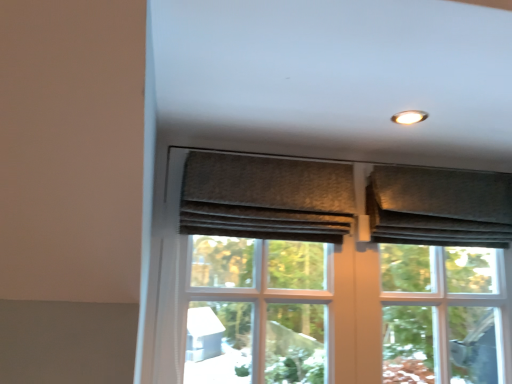
Question: Is matte brown screen door at center wider or thinner than textured gray fabric at upper right?

Choices:
 (A) thin
 (B) wide

Answer: (A)

Question: From the image's perspective, is matte brown screen door at center positioned above or below textured gray fabric at upper right?

Choices:
 (A) above
 (B) below

Answer: (B)

Question: Estimate the real-world distances between objects in this image. Which object is closer to the textured gray curtain at upper center, which is the 1th curtain in left-to-right order?

Choices:
 (A) matte brown screen door at center
 (B) textured gray fabric at upper right
 (C) textured gray curtain at upper right, the 2th curtain viewed from the left

Answer: (A)

Question: Estimate the real-world distances between objects in this image. Which object is farther from the matte brown screen door at center?

Choices:
 (A) textured gray curtain at upper center, which ranks as the second curtain in right-to-left order
 (B) textured gray fabric at upper right
 (C) textured gray curtain at upper right, the 1th curtain when ordered from right to left

Answer: (C)